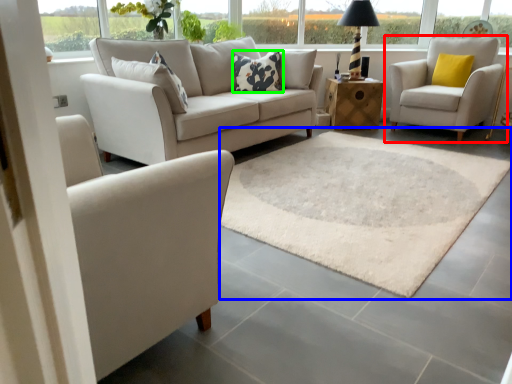
Question: Based on their relative distances, which object is nearer to chair (highlighted by a red box)? Choose from mat (highlighted by a blue box) and pillow (highlighted by a green box).

Choices:
 (A) mat
 (B) pillow

Answer: (A)